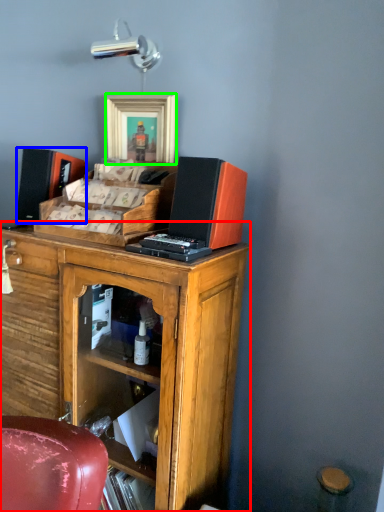
Question: Estimate the real-world distances between objects in this image. Which object is closer to cabinetry (highlighted by a red box), speaker (highlighted by a blue box) or picture frame (highlighted by a green box)?

Choices:
 (A) speaker
 (B) picture frame

Answer: (A)